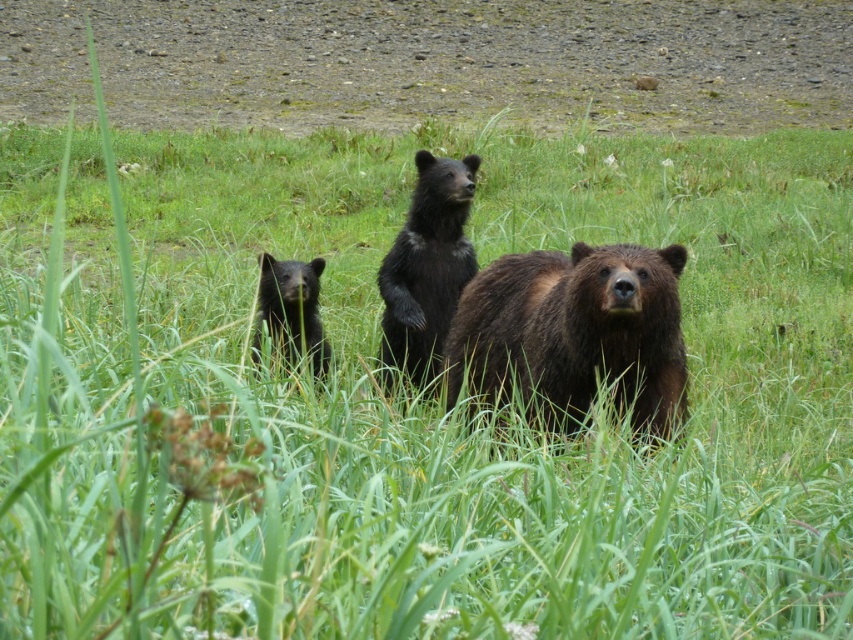
Question: Is brown furry bear at center bigger than black fur bear at center?

Choices:
 (A) yes
 (B) no

Answer: (A)

Question: Does brown furry bear at center appear on the left side of black fuzzy bear cub at center?

Choices:
 (A) yes
 (B) no

Answer: (B)

Question: Can you confirm if brown furry bear at center is bigger than black fuzzy bear cub at center?

Choices:
 (A) yes
 (B) no

Answer: (A)

Question: Which of these objects is positioned farthest from the black fuzzy bear cub at center?

Choices:
 (A) brown furry bear at center
 (B) black fur bear at center

Answer: (A)

Question: Which of these objects is positioned farthest from the black fur bear at center?

Choices:
 (A) brown furry bear at center
 (B) black fuzzy bear cub at center

Answer: (A)

Question: Estimate the real-world distances between objects in this image. Which object is farther from the brown furry bear at center?

Choices:
 (A) black fuzzy bear cub at center
 (B) black fur bear at center

Answer: (A)